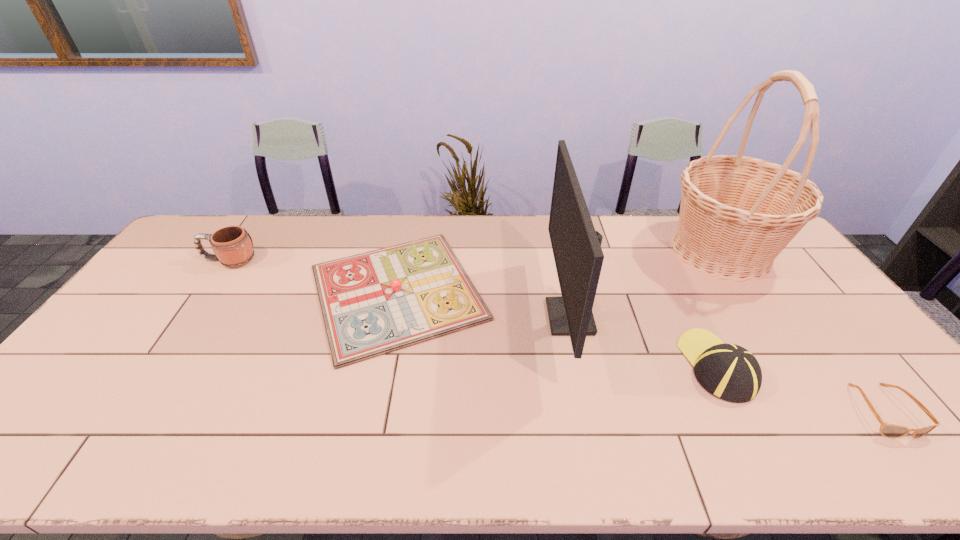
The height and width of the screenshot is (540, 960). In the image, there is a desktop. What are the coordinates of `blank space at the left edge` in the screenshot? It's located at (173, 260).

I want to click on free space at the near left corner of the desktop, so click(x=27, y=448).

Where is `empty location between the sunglasses and the tallest object`? empty location between the sunglasses and the tallest object is located at coordinates (802, 331).

You are a GUI agent. You are given a task and a screenshot of the screen. Output one action in this format:
    pyautogui.click(x=<x>, y=<y>)
    Task: Click on the unoccupied position between the second tallest object and the baseball cap
    
    Given the screenshot: What is the action you would take?
    pyautogui.click(x=643, y=341)

Locate an element on the screen. The width and height of the screenshot is (960, 540). object that is the nearest to the baseball cap is located at coordinates (737, 213).

Identify the location of object that is the closest one to the baseball cap. The width and height of the screenshot is (960, 540). (737, 213).

This screenshot has width=960, height=540. In order to click on free space that satisfies the following two spatial constraints: 1. on the side of the gameboard with the handle; 2. on the left side of the leftmost object in this screenshot , I will do `click(207, 292)`.

I want to click on free space that satisfies the following two spatial constraints: 1. on the front side of the basket; 2. on the front-facing side of the fourth object from right to left, so click(765, 317).

Image resolution: width=960 pixels, height=540 pixels. What are the coordinates of `vacant space that satisfies the following two spatial constraints: 1. with the brim of the baseball cap facing forward; 2. on the front-facing side of the computer monitor` in the screenshot? It's located at (692, 317).

Where is `vacant region that satisfies the following two spatial constraints: 1. on the side of the mug with the handle; 2. with the brim of the baseball cap facing forward`? The height and width of the screenshot is (540, 960). vacant region that satisfies the following two spatial constraints: 1. on the side of the mug with the handle; 2. with the brim of the baseball cap facing forward is located at coordinates (157, 366).